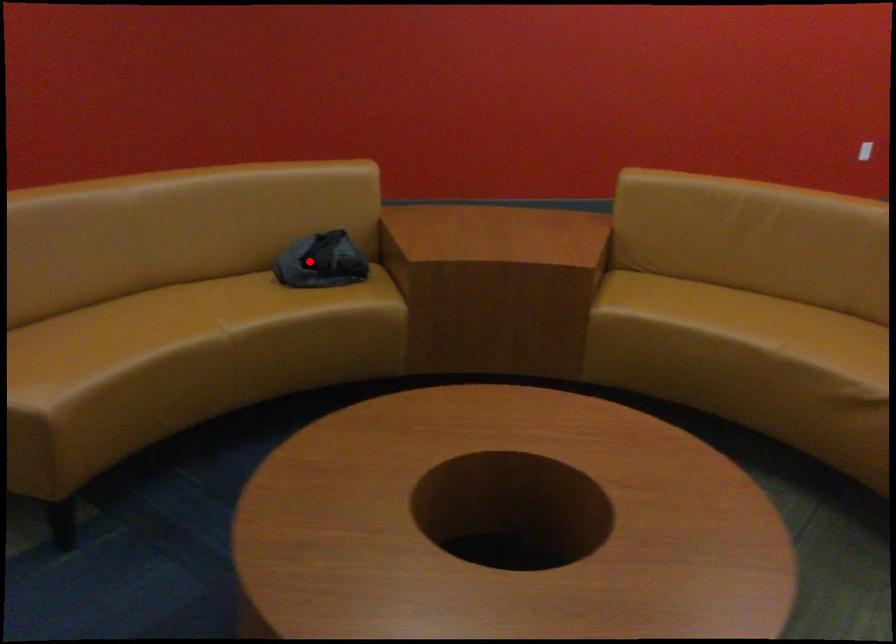
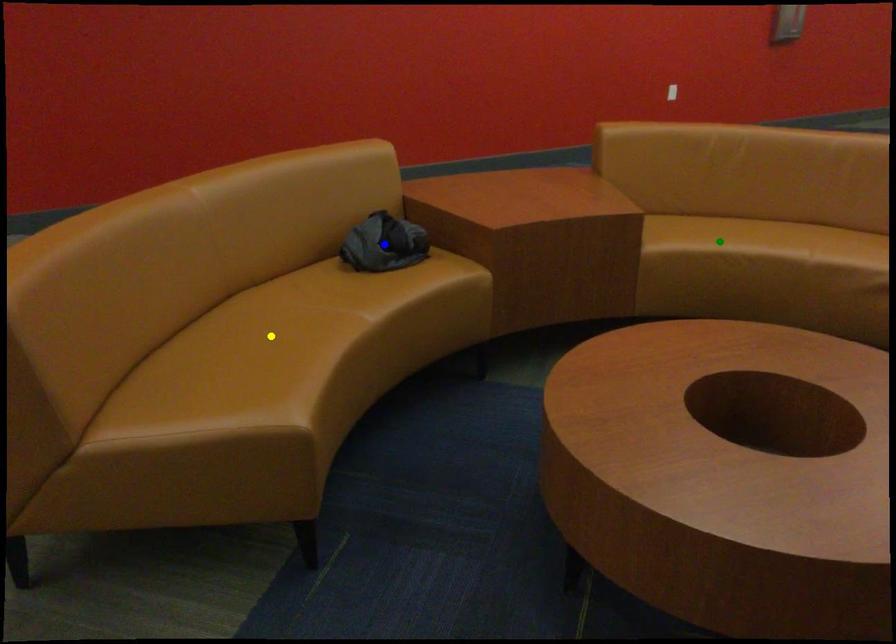
Question: I am providing you with two images of the same scene from different viewpoints. A red point is marked on the first image. You are given multiple points on the second image. In image 2, which mark is for the same physical point as the one in image 1?

Choices:
 (A) green point
 (B) blue point
 (C) yellow point

Answer: (B)